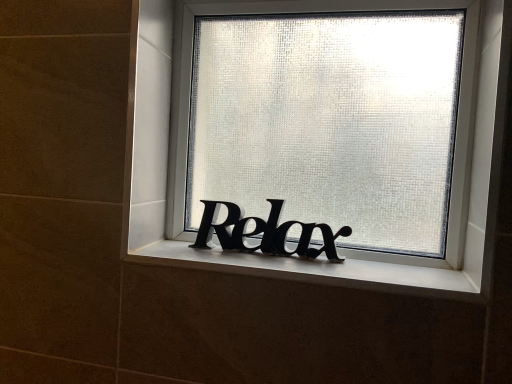
Where is `vacant space situated above white smooth window sill at center (from a real-world perspective)`? vacant space situated above white smooth window sill at center (from a real-world perspective) is located at coordinates (345, 266).